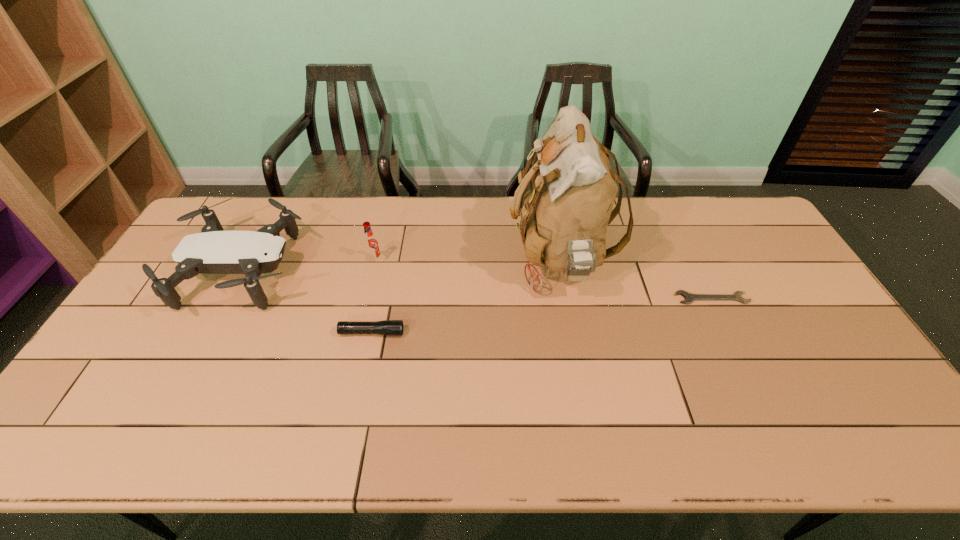
You are a GUI agent. You are given a task and a screenshot of the screen. Output one action in this format:
    pyautogui.click(x=<x>, y=<y>)
    Task: Click on the backpack
    The image size is (960, 540).
    Given the screenshot: What is the action you would take?
    pyautogui.click(x=566, y=199)

Locate an element on the screen. The image size is (960, 540). the fourth object from left to right is located at coordinates (566, 199).

At what (x,y) coordinates should I click in order to perform the action: click on root beer. Please return your answer as a coordinate pair (x, y). Looking at the image, I should click on (371, 245).

This screenshot has height=540, width=960. I want to click on the leftmost object, so click(213, 251).

In order to click on the fourth tallest object in this screenshot , I will do `click(386, 327)`.

You are a GUI agent. You are given a task and a screenshot of the screen. Output one action in this format:
    pyautogui.click(x=<x>, y=<y>)
    Task: Click on the nearest object
    This screenshot has width=960, height=540.
    Given the screenshot: What is the action you would take?
    pyautogui.click(x=386, y=327)

Where is `the rightmost object`? The image size is (960, 540). the rightmost object is located at coordinates (689, 297).

Find the location of a particular element. This screenshot has width=960, height=540. wrench is located at coordinates (689, 297).

The width and height of the screenshot is (960, 540). Find the location of `vacant space located 0.250m on the front-facing side of the backpack`. vacant space located 0.250m on the front-facing side of the backpack is located at coordinates (429, 261).

You are a GUI agent. You are given a task and a screenshot of the screen. Output one action in this format:
    pyautogui.click(x=<x>, y=<y>)
    Task: Click on the free region located on the front-facing side of the backpack
    
    Given the screenshot: What is the action you would take?
    pyautogui.click(x=451, y=261)